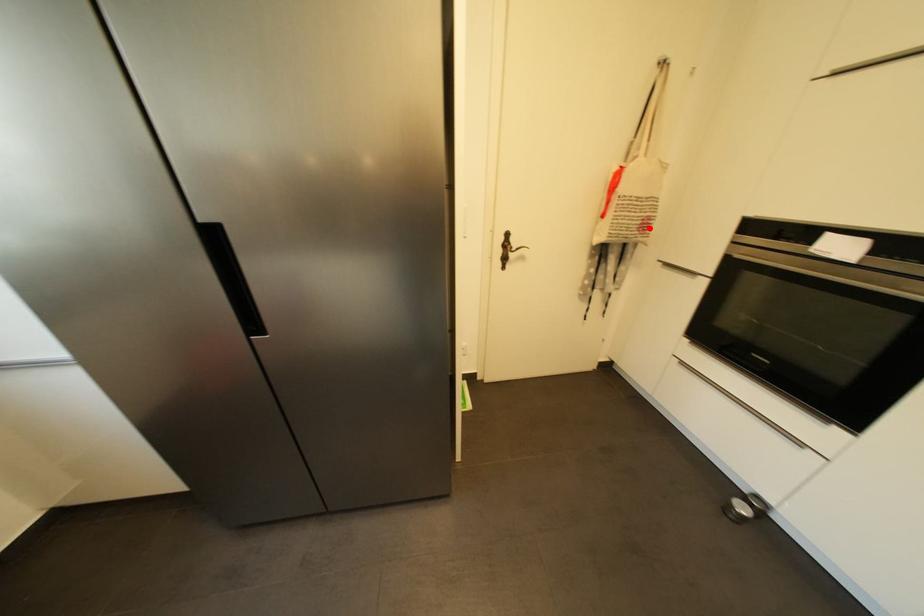
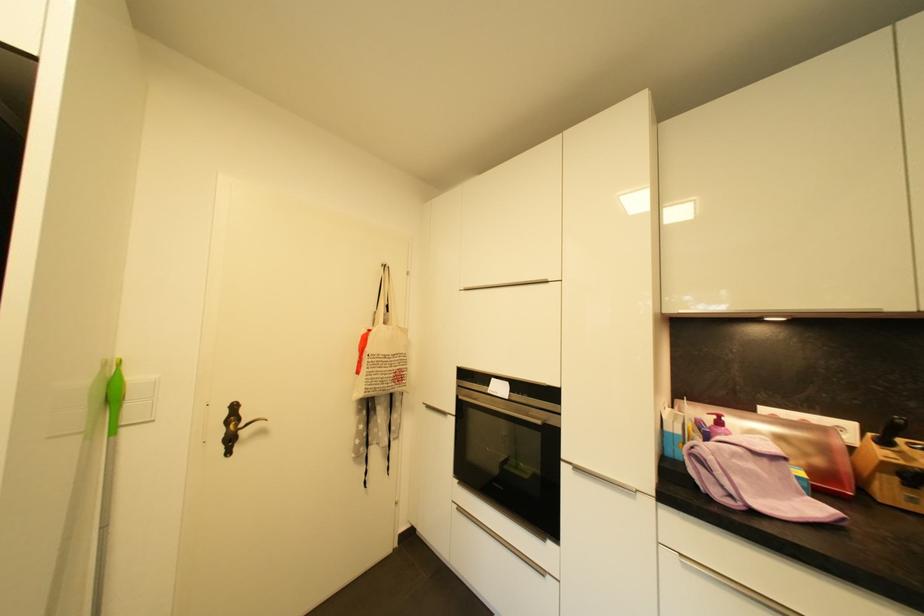
In the second image, find the point that corresponds to the highlighted location in the first image.

(405, 379)